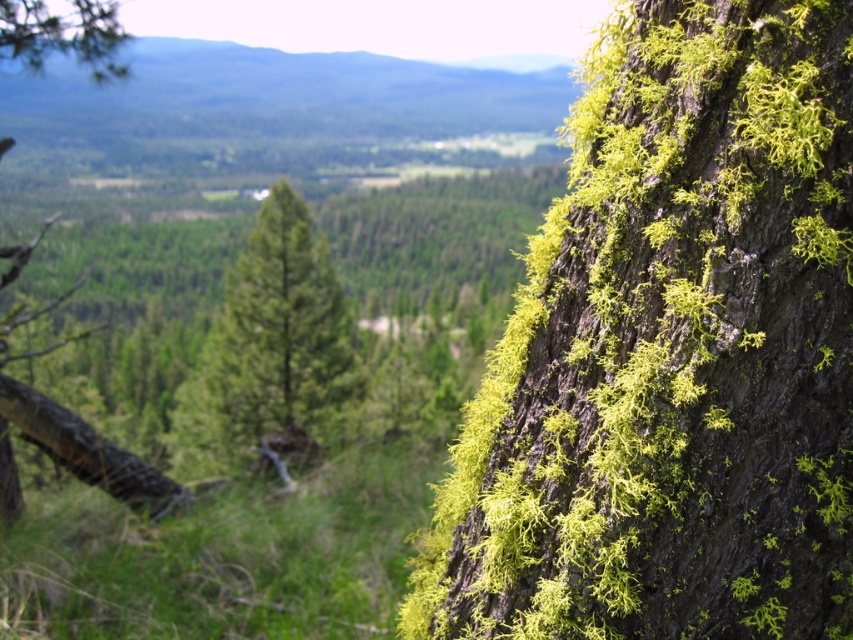
Is green mossy bark at right taller than green mossy tree trunk at left?

Yes.

Which is in front, point (662, 598) or point (125, 477)?

Positioned in front is point (662, 598).

The width and height of the screenshot is (853, 640). I want to click on green mossy bark at right, so click(x=671, y=353).

Does green textured pine tree at center have a lesser width compared to green mossy tree trunk at left?

Incorrect, green textured pine tree at center's width is not less than green mossy tree trunk at left's.

Measure the distance from green textured pine tree at center to green mossy tree trunk at left.

green textured pine tree at center and green mossy tree trunk at left are 14.01 feet apart from each other.

Describe the element at coordinates (267, 353) in the screenshot. I see `green textured pine tree at center` at that location.

Where is `green textured pine tree at center`? Image resolution: width=853 pixels, height=640 pixels. green textured pine tree at center is located at coordinates (267, 353).

Between point (792, 371) and point (233, 412), which one is positioned behind?

The point (233, 412) is behind.

Does green mossy bark at right have a smaller size compared to green textured pine tree at center?

Yes.

Is point (715, 387) in front of point (286, 403)?

That is True.

You are a GUI agent. You are given a task and a screenshot of the screen. Output one action in this format:
    pyautogui.click(x=<x>, y=<y>)
    Task: Click on the green mossy bark at right
    
    Given the screenshot: What is the action you would take?
    pyautogui.click(x=671, y=353)